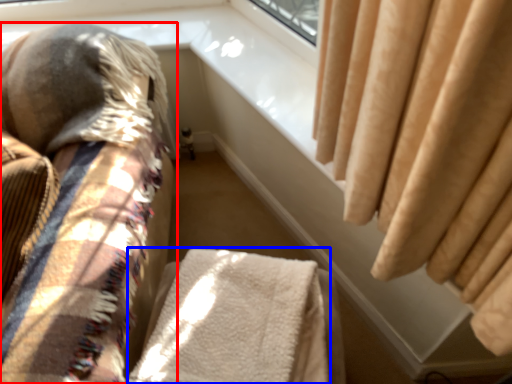
Question: Which object is closer to the camera taking this photo, furniture (highlighted by a red box) or blanket (highlighted by a blue box)?

Choices:
 (A) furniture
 (B) blanket

Answer: (A)